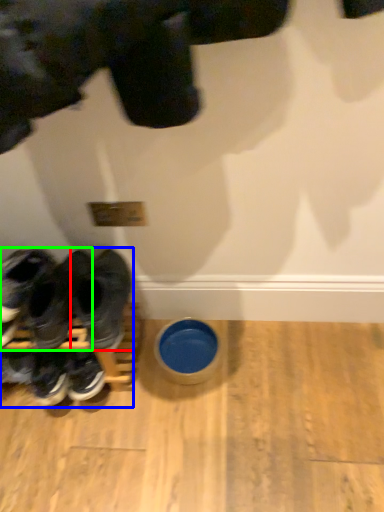
Question: Estimate the real-world distances between objects in this image. Which object is closer to footwear (highlighted by a red box), footwear (highlighted by a blue box) or footwear (highlighted by a green box)?

Choices:
 (A) footwear
 (B) footwear

Answer: (A)